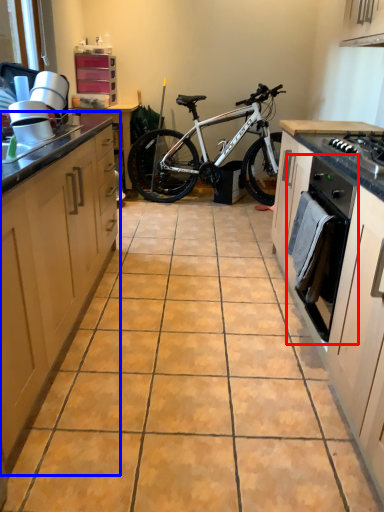
Question: Among these objects, which one is farthest to the camera, oven (highlighted by a red box) or cabinetry (highlighted by a blue box)?

Choices:
 (A) oven
 (B) cabinetry

Answer: (A)